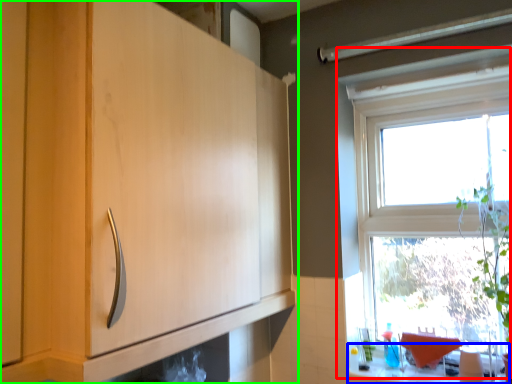
Question: Which object is positioned farthest from window (highlighted by a red box)? Select from counter top (highlighted by a blue box) and cabinetry (highlighted by a green box).

Choices:
 (A) counter top
 (B) cabinetry

Answer: (B)